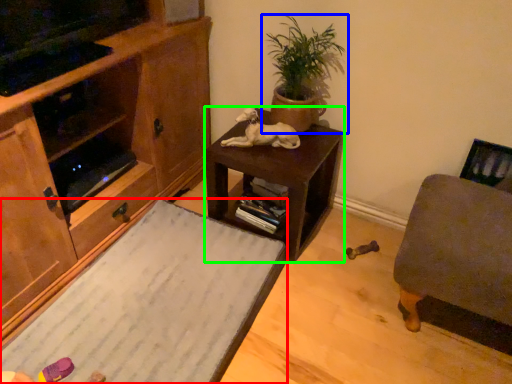
Question: Based on their relative distances, which object is nearer to desk (highlighted by a red box)? Choose from houseplant (highlighted by a blue box) and table (highlighted by a green box).

Choices:
 (A) houseplant
 (B) table

Answer: (B)